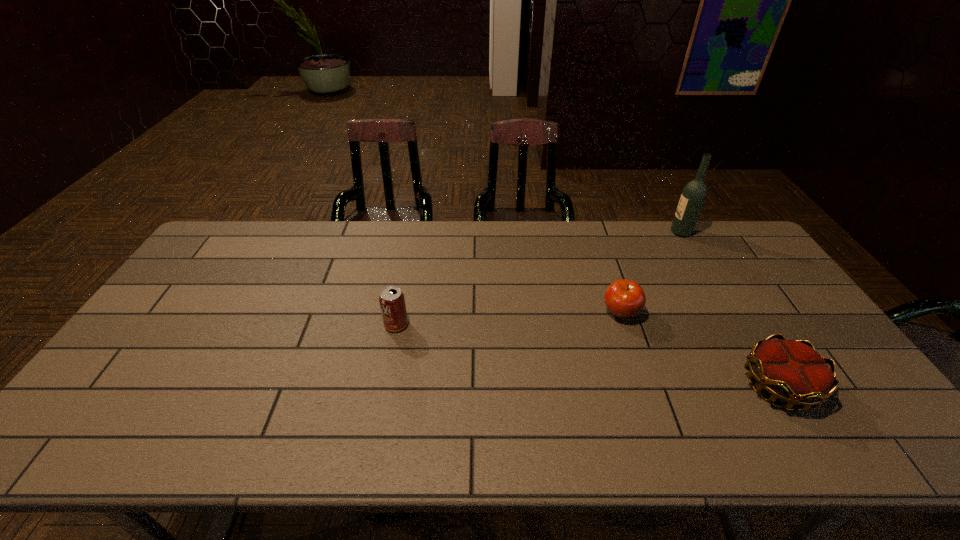
Locate an element on the screen. The height and width of the screenshot is (540, 960). vacant space located on the back of the nearest object is located at coordinates [x=704, y=261].

Find the location of a particular element. object at the far edge is located at coordinates (693, 196).

Locate an element on the screen. object present at the right edge is located at coordinates (792, 371).

Find the location of a particular element. free spot at the far edge of the desktop is located at coordinates (683, 247).

You are a GUI agent. You are given a task and a screenshot of the screen. Output one action in this format:
    pyautogui.click(x=<x>, y=<y>)
    Task: Click on the vacant region at the near edge
    This screenshot has height=540, width=960.
    Given the screenshot: What is the action you would take?
    pyautogui.click(x=431, y=441)

Identify the location of vacant space at the left edge of the desktop. (182, 291).

Locate an element on the screen. The image size is (960, 540). vacant space that's between the soda can and the nearest object is located at coordinates (588, 355).

This screenshot has height=540, width=960. Find the location of `vacant space that's between the soda can and the apple`. vacant space that's between the soda can and the apple is located at coordinates (509, 319).

You are a GUI agent. You are given a task and a screenshot of the screen. Output one action in this format:
    pyautogui.click(x=<x>, y=<y>)
    Task: Click on the free space between the farthest object and the leftmost object
    The width and height of the screenshot is (960, 540).
    Given the screenshot: What is the action you would take?
    pyautogui.click(x=539, y=279)

At what (x,y) coordinates should I click in order to perform the action: click on free space between the wine bottle and the second object from left to right. Please return your answer as a coordinate pair (x, y). The image size is (960, 540). Looking at the image, I should click on (651, 273).